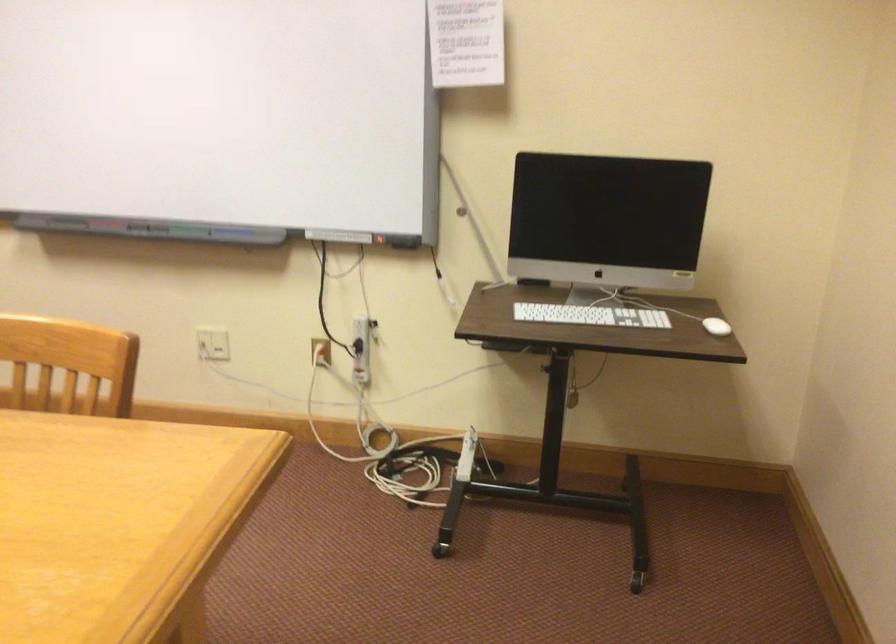
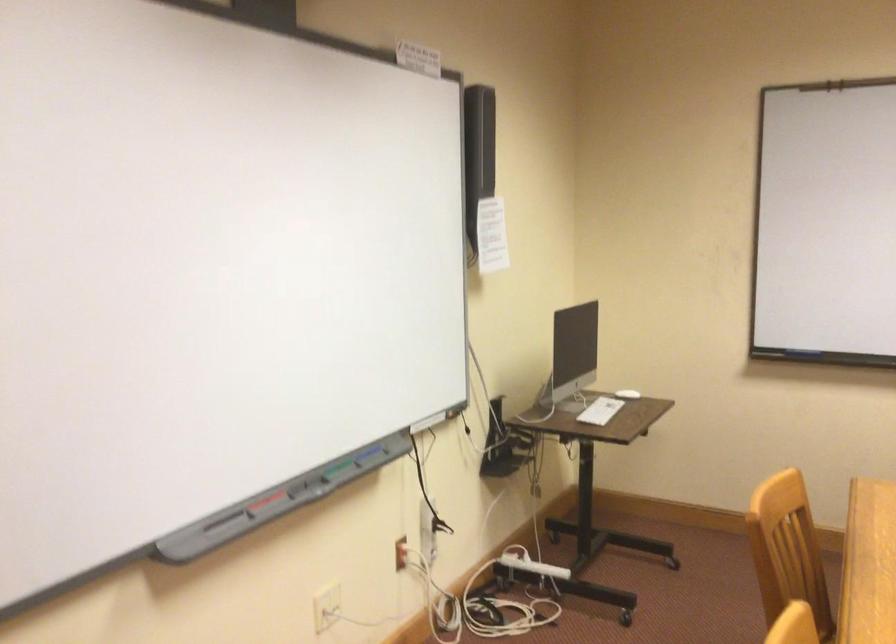
The point at (471,455) is marked in the first image. Where is the corresponding point in the second image?

(530, 564)